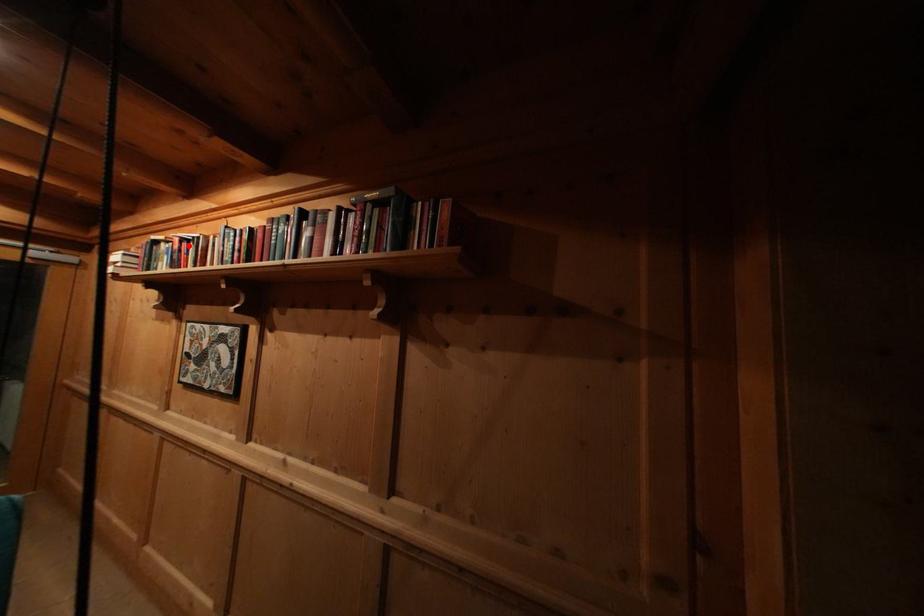
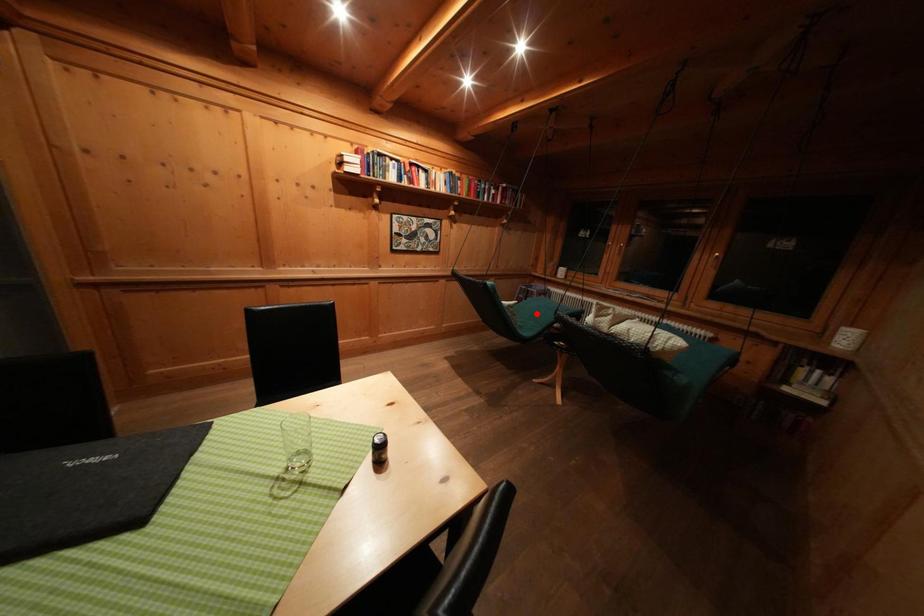
I am providing you with two images of the same scene from different viewpoints. A red point is marked on the first image and another point is marked on the second image. Is the marked point in image1 the same physical position as the marked point in image2?

No